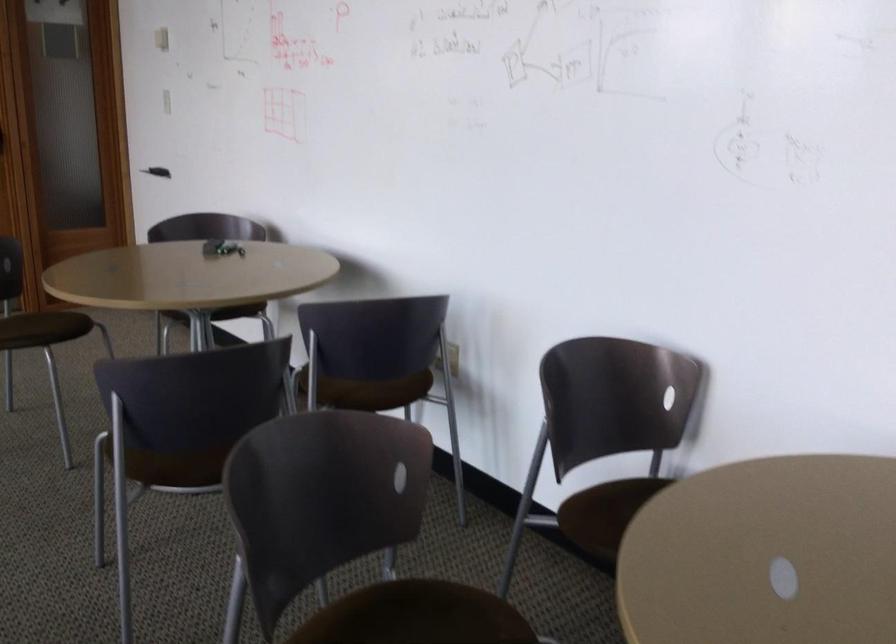
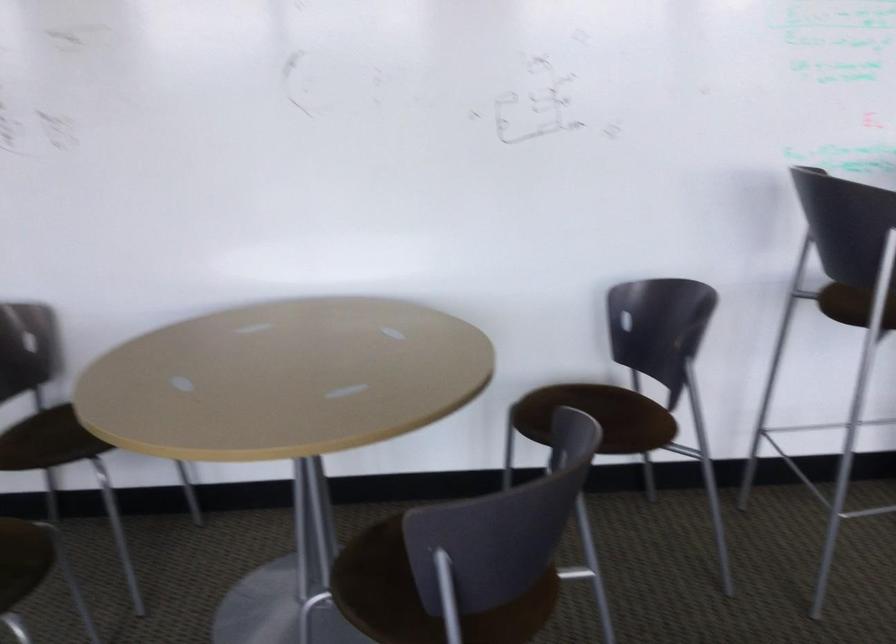
Question: The camera is either moving clockwise (left) or counter-clockwise (right) around the object. The first image is from the beginning of the video and the second image is from the end. Is the camera moving left or right when shooting the video?

Choices:
 (A) Left
 (B) Right

Answer: (A)